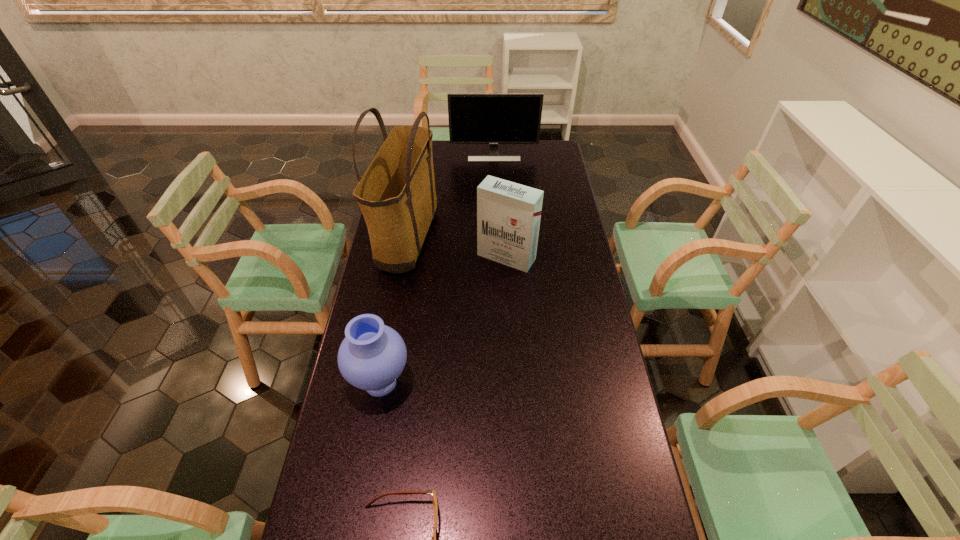
Where is `the tallest object`? the tallest object is located at coordinates (396, 194).

At what (x,y) coordinates should I click in order to perform the action: click on the farthest object. Please return your answer as a coordinate pair (x, y). The image size is (960, 540). Looking at the image, I should click on (493, 119).

Find the location of a particular element. cigarette case is located at coordinates (508, 214).

You are a GUI agent. You are given a task and a screenshot of the screen. Output one action in this format:
    pyautogui.click(x=<x>, y=<y>)
    Task: Click on the fourth tallest object
    
    Given the screenshot: What is the action you would take?
    pyautogui.click(x=371, y=357)

You are a GUI agent. You are given a task and a screenshot of the screen. Output one action in this format:
    pyautogui.click(x=<x>, y=<y>)
    Task: Click on the fourth farthest object
    The image size is (960, 540).
    Given the screenshot: What is the action you would take?
    pyautogui.click(x=371, y=357)

Where is `vacant space located 0.330m on the right of the tallest object`? The image size is (960, 540). vacant space located 0.330m on the right of the tallest object is located at coordinates (523, 242).

Identify the location of vacant region located on the screen side of the monitor. (495, 179).

The height and width of the screenshot is (540, 960). In order to click on vacant space located on the front of the cigarette case in this screenshot , I will do `click(511, 324)`.

The width and height of the screenshot is (960, 540). In order to click on vacant space located on the right of the second nearest object in this screenshot , I will do `click(510, 383)`.

The width and height of the screenshot is (960, 540). Identify the location of object located in the far edge section of the desktop. (493, 119).